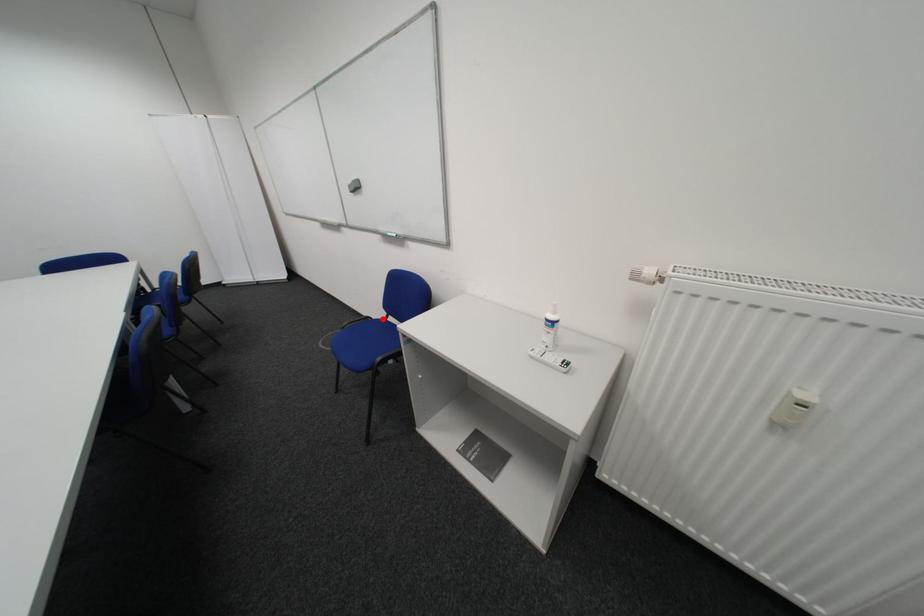
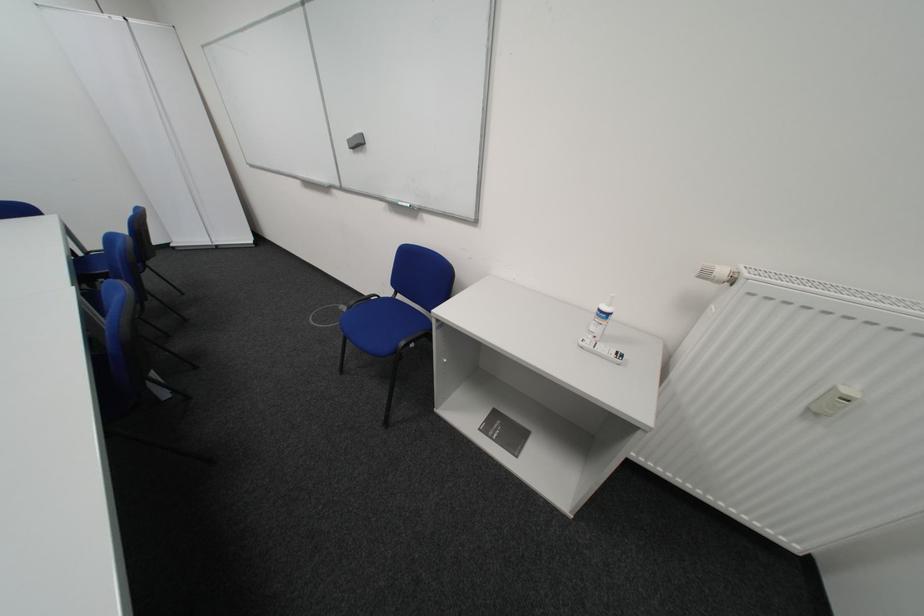
Question: I am providing you with two images of the same scene from different viewpoints. Image1 has a red point marked. In image2, the corresponding 3D location appears at what relative position? Reply with the corresponding letter.

Choices:
 (A) Closer
 (B) Farther

Answer: (A)